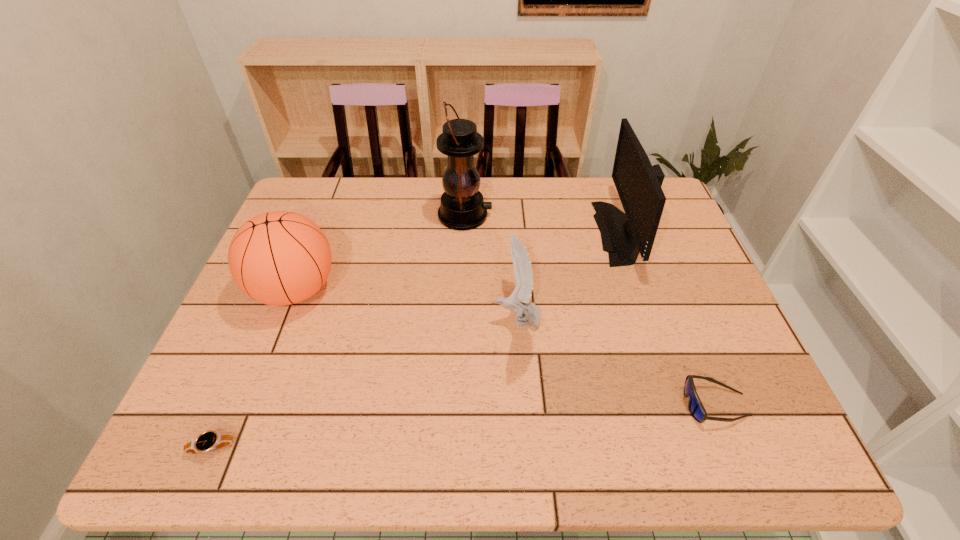
The width and height of the screenshot is (960, 540). In order to click on vacant space in between the lantern and the fifth shortest object in this screenshot , I will do `click(545, 224)`.

Where is `free space between the sunglasses and the fourth tallest object`? The image size is (960, 540). free space between the sunglasses and the fourth tallest object is located at coordinates (615, 362).

Locate an element on the screen. The width and height of the screenshot is (960, 540). empty location between the tallest object and the gull is located at coordinates (491, 267).

Where is `free space between the nearest object and the second nearest object`? free space between the nearest object and the second nearest object is located at coordinates (464, 426).

Find the location of `free space between the gull and the lantern`. free space between the gull and the lantern is located at coordinates (491, 267).

Locate an element on the screen. Image resolution: width=960 pixels, height=540 pixels. free spot between the second shortest object and the lantern is located at coordinates (590, 310).

Locate an element on the screen. object that is the fourth nearest to the gull is located at coordinates (278, 258).

Select which object is the fourth closest to the gull. Please provide its 2D coordinates. Your answer should be formatted as a tuple, i.e. [(x, y)], where the tuple contains the x and y coordinates of a point satisfying the conditions above.

[(278, 258)]